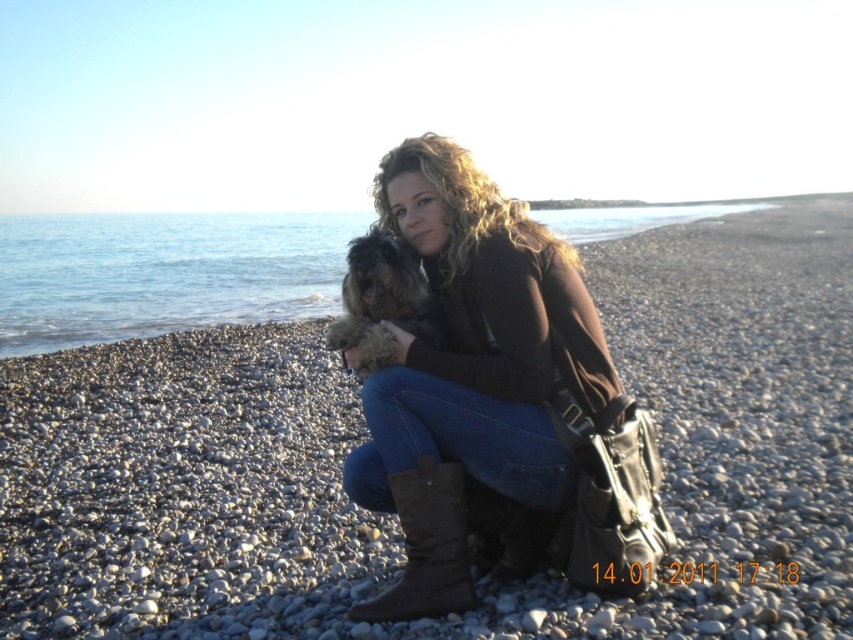
Does point (445, 428) lie behind point (364, 348)?

No, (445, 428) is in front of (364, 348).

Is brown suede boots at lower center taller than fuzzy brown dog at center?

Yes, brown suede boots at lower center is taller than fuzzy brown dog at center.

What do you see at coordinates (471, 372) in the screenshot? I see `brown suede boots at lower center` at bounding box center [471, 372].

Locate an element on the screen. This screenshot has width=853, height=640. brown suede boots at lower center is located at coordinates click(x=471, y=372).

Between pebble beach at center and fuzzy brown dog at center, which one is positioned lower?

fuzzy brown dog at center is below.

Consider the image. Who is higher up, pebble beach at center or fuzzy brown dog at center?

Positioned higher is pebble beach at center.

At what (x,y) coordinates should I click in order to perform the action: click on pebble beach at center. Please return your answer as a coordinate pair (x, y). The image size is (853, 640). Looking at the image, I should click on (392, 516).

Where is `pebble beach at center`? pebble beach at center is located at coordinates (392, 516).

Is pebble beach at center below brown suede boot at lower center?

Actually, pebble beach at center is above brown suede boot at lower center.

Does point (293, 538) come farther from viewer compared to point (432, 602)?

Yes, point (293, 538) is behind point (432, 602).

At what (x,y) coordinates should I click in order to perform the action: click on pebble beach at center. Please return your answer as a coordinate pair (x, y). The height and width of the screenshot is (640, 853). Looking at the image, I should click on (392, 516).